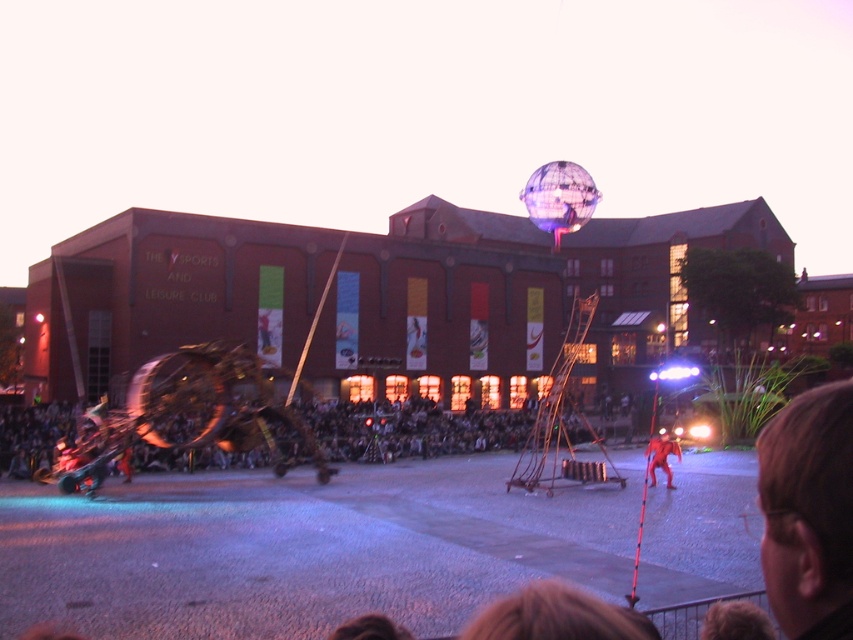
You are an event planner setting up chairs for an audience. You see the dark brown wooden bench at lower center and the red fabric person at center. Which object is positioned higher in the image?

The dark brown wooden bench at lower center is above the red fabric person at center, so it is positioned higher in the image.

You are an event planner trying to set up a new light display. You have a spotlight that can only cover objects up to the size of the red fabric person at center. Can you use the same spotlight to illuminate the translucent purple sphere at upper center without needing a larger one?

The translucent purple sphere at upper center is wider than the red fabric person at center, so the spotlight designed for the red fabric person at center may not be sufficient to fully illuminate the translucent purple sphere at upper center. A larger spotlight might be necessary.

You are attending an evening event at the Sports and Leisure Club and see the dark brown wooden bench at lower center and the red fabric person at center. Which object is closer to the entrance of the building labeled THE SPORTS AND LEISURE CLUB?

The dark brown wooden bench at lower center is positioned on the left side of the red fabric person at center, so the dark brown wooden bench at lower center is closer to the entrance of the building labeled THE SPORTS AND LEISURE CLUB.